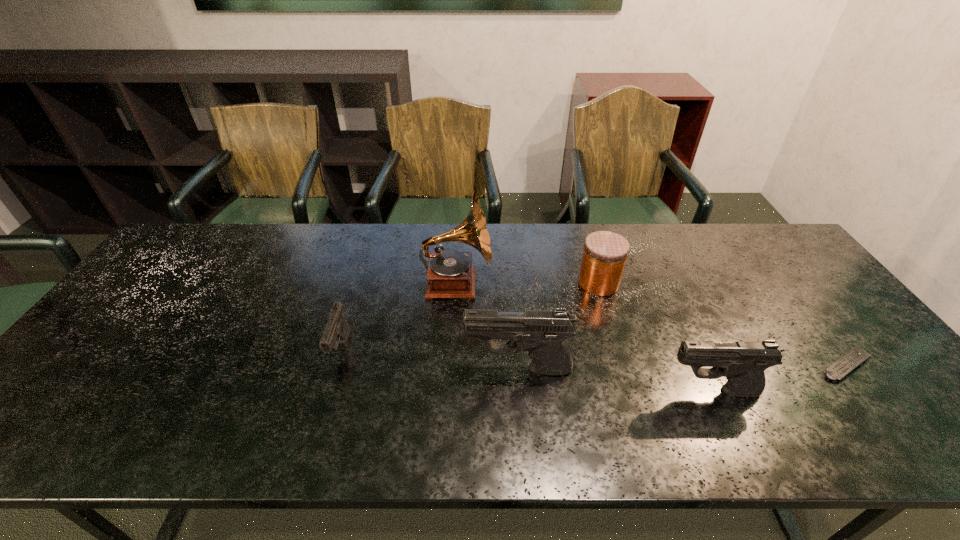
Locate an element on the screen. The width and height of the screenshot is (960, 540). remote control that is at the near edge is located at coordinates (843, 366).

Find the location of `object that is at the right edge`. object that is at the right edge is located at coordinates (843, 366).

Image resolution: width=960 pixels, height=540 pixels. In order to click on object that is at the near right corner in this screenshot , I will do `click(843, 366)`.

Locate an element on the screen. The width and height of the screenshot is (960, 540). vacant space at the far edge of the desktop is located at coordinates (581, 231).

Identify the location of vacant space at the near edge of the desktop. (616, 402).

I want to click on vacant space at the left edge of the desktop, so click(121, 341).

This screenshot has height=540, width=960. In the image, there is a desktop. In order to click on vacant space at the right edge in this screenshot , I will do `click(805, 272)`.

At what (x,y) coordinates should I click in order to perform the action: click on vacant region at the far left corner of the desktop. Please return your answer as a coordinate pair (x, y). The image size is (960, 540). Looking at the image, I should click on (217, 230).

The width and height of the screenshot is (960, 540). What are the coordinates of `vacant space that's between the second pistol from right to left and the shortest pistol` in the screenshot? It's located at (430, 359).

Where is `free space between the third object from right to left and the tallest object`? The height and width of the screenshot is (540, 960). free space between the third object from right to left and the tallest object is located at coordinates (528, 283).